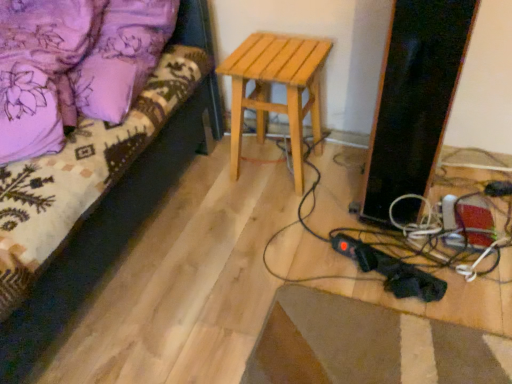
The width and height of the screenshot is (512, 384). What do you see at coordinates (278, 83) in the screenshot?
I see `light brown wooden stool at center` at bounding box center [278, 83].

Where is `light brown wooden stool at center`? light brown wooden stool at center is located at coordinates (278, 83).

Measure the distance between light brown wooden stool at center and camera.

A distance of 4.18 feet exists between light brown wooden stool at center and camera.

The height and width of the screenshot is (384, 512). Describe the element at coordinates (94, 161) in the screenshot. I see `velvet purple bedspread at upper left` at that location.

I want to click on velvet purple bedspread at upper left, so click(94, 161).

You are a GUI agent. You are given a task and a screenshot of the screen. Output one action in this format:
    pyautogui.click(x=<x>, y=<y>)
    Task: Click on the light brown wooden stool at center
    
    Given the screenshot: What is the action you would take?
    click(278, 83)

Which object is positioned more to the right, velvet purple bedspread at upper left or light brown wooden stool at center?

light brown wooden stool at center.

Is velvet purple bedspread at upper left further to the viewer compared to light brown wooden stool at center?

No, velvet purple bedspread at upper left is closer to the viewer.

Looking at this image, which is closer to the camera, (92, 124) or (298, 50)?

The point (92, 124) is more forward.

From the image's perspective, would you say velvet purple bedspread at upper left is shown under light brown wooden stool at center?

Yes, from the image's perspective, velvet purple bedspread at upper left is beneath light brown wooden stool at center.

From a real-world perspective, which object stands above the other?

velvet purple bedspread at upper left.

Considering the sizes of objects velvet purple bedspread at upper left and light brown wooden stool at center in the image provided, who is wider, velvet purple bedspread at upper left or light brown wooden stool at center?

velvet purple bedspread at upper left.

Which of these two, velvet purple bedspread at upper left or light brown wooden stool at center, stands taller?

light brown wooden stool at center.

Considering the relative sizes of velvet purple bedspread at upper left and light brown wooden stool at center in the image provided, is velvet purple bedspread at upper left bigger than light brown wooden stool at center?

Correct, velvet purple bedspread at upper left is larger in size than light brown wooden stool at center.

Is velvet purple bedspread at upper left situated inside light brown wooden stool at center or outside?

velvet purple bedspread at upper left is outside light brown wooden stool at center.

Is velvet purple bedspread at upper left next to light brown wooden stool at center?

velvet purple bedspread at upper left is not next to light brown wooden stool at center, and they're not touching.

Is velvet purple bedspread at upper left oriented towards light brown wooden stool at center?

No, velvet purple bedspread at upper left is not aimed at light brown wooden stool at center.

Where is `furniture in front of the light brown wooden stool at center`? furniture in front of the light brown wooden stool at center is located at coordinates (94, 161).

Consider the image. Considering the relative positions of light brown wooden stool at center and velvet purple bedspread at upper left in the image provided, is light brown wooden stool at center to the left or to the right of velvet purple bedspread at upper left?

From the image, it's evident that light brown wooden stool at center is to the right of velvet purple bedspread at upper left.

From the picture: Considering their positions, is light brown wooden stool at center located in front of or behind velvet purple bedspread at upper left?

Visually, light brown wooden stool at center is located behind velvet purple bedspread at upper left.

Which is closer, (270, 53) or (53, 191)?

Point (270, 53) is positioned farther from the camera compared to point (53, 191).

From the image's perspective, which object appears higher, light brown wooden stool at center or velvet purple bedspread at upper left?

light brown wooden stool at center appears higher in the image.

From a real-world perspective, does light brown wooden stool at center sit lower than velvet purple bedspread at upper left?

Yes, from a real-world perspective, light brown wooden stool at center is beneath velvet purple bedspread at upper left.

Does light brown wooden stool at center have a lesser width compared to velvet purple bedspread at upper left?

Indeed, light brown wooden stool at center has a lesser width compared to velvet purple bedspread at upper left.

Between light brown wooden stool at center and velvet purple bedspread at upper left, which one has less height?

velvet purple bedspread at upper left.

Which of these two, light brown wooden stool at center or velvet purple bedspread at upper left, is smaller?

light brown wooden stool at center is smaller.

Is light brown wooden stool at center spatially inside velvet purple bedspread at upper left, or outside of it?

light brown wooden stool at center cannot be found inside velvet purple bedspread at upper left.

Looking at this image, is light brown wooden stool at center far away from velvet purple bedspread at upper left?

No, light brown wooden stool at center is not far away from velvet purple bedspread at upper left.

Is light brown wooden stool at center aimed at velvet purple bedspread at upper left?

No, light brown wooden stool at center is not aimed at velvet purple bedspread at upper left.

How different are the orientations of light brown wooden stool at center and velvet purple bedspread at upper left in degrees?

They differ by 93.9 degrees in their facing directions.

How much distance is there between light brown wooden stool at center and velvet purple bedspread at upper left?

light brown wooden stool at center and velvet purple bedspread at upper left are 13.87 inches apart from each other.

I want to click on furniture in front of the light brown wooden stool at center, so click(94, 161).

What are the coordinates of `furniture that is above the light brown wooden stool at center (from a real-world perspective)` in the screenshot? It's located at (94, 161).

Locate an element on the screen. The image size is (512, 384). stool on the right of velvet purple bedspread at upper left is located at coordinates (278, 83).